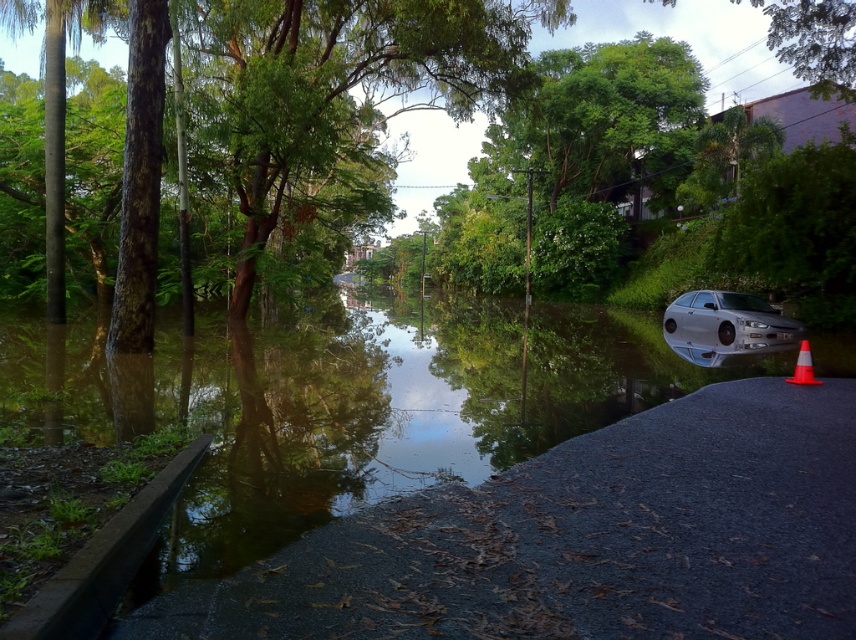
Question: Does clear water at road right come behind orange reflective cone at lower right?

Choices:
 (A) yes
 (B) no

Answer: (B)

Question: Which of the following is the closest to the observer?

Choices:
 (A) (797, 372)
 (B) (607, 412)

Answer: (B)

Question: Can you confirm if clear water at road right is positioned above orange reflective cone at lower right?

Choices:
 (A) no
 (B) yes

Answer: (B)

Question: Considering the real-world distances, which object is closest to the orange reflective cone at lower right?

Choices:
 (A) silver metallic car at lower right
 (B) clear water at road right

Answer: (A)

Question: Does clear water at road right lie behind silver metallic car at lower right?

Choices:
 (A) yes
 (B) no

Answer: (B)

Question: Which of the following is the farthest from the observer?

Choices:
 (A) silver metallic car at lower right
 (B) clear water at road right

Answer: (A)